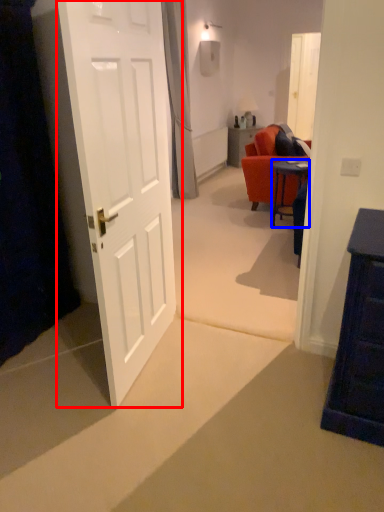
Question: Which object appears closest to the camera in this image, door (highlighted by a red box) or desk (highlighted by a blue box)?

Choices:
 (A) door
 (B) desk

Answer: (A)